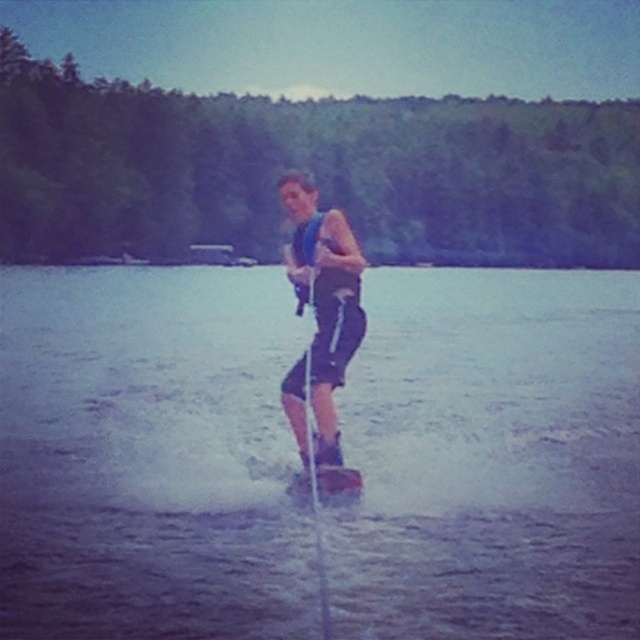
In the scene shown: How far apart are clear water at center and blue fabric life vest at center?

15.98 meters

Who is positioned more to the left, clear water at center or blue fabric life vest at center?

blue fabric life vest at center is more to the left.

Does point (499, 611) lie behind point (317, 282)?

That is False.

You are a GUI agent. You are given a task and a screenshot of the screen. Output one action in this format:
    pyautogui.click(x=<x>, y=<y>)
    Task: Click on the clear water at center
    The width and height of the screenshot is (640, 640).
    Given the screenshot: What is the action you would take?
    pyautogui.click(x=148, y=456)